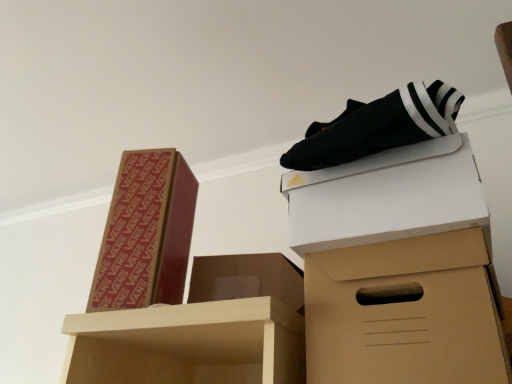
Question: Does brown cardboard box at upper left, arranged as the 3th box when viewed from the right, have a lesser height compared to brown cardboard box at lower right?

Choices:
 (A) no
 (B) yes

Answer: (A)

Question: Is the surface of brown cardboard box at upper left, the first box positioned from the left, in direct contact with brown cardboard box at lower right?

Choices:
 (A) yes
 (B) no

Answer: (B)

Question: From a real-world perspective, is brown cardboard box at upper left, arranged as the 3th box when viewed from the right, under brown cardboard box at lower right?

Choices:
 (A) yes
 (B) no

Answer: (B)

Question: Could you tell me if brown cardboard box at upper left, arranged as the 3th box when viewed from the right, is turned towards brown cardboard box at lower right?

Choices:
 (A) no
 (B) yes

Answer: (A)

Question: Would you say brown cardboard box at upper left, arranged as the 3th box when viewed from the right, is outside brown cardboard box at lower right?

Choices:
 (A) no
 (B) yes

Answer: (B)

Question: Considering the relative positions of brown cardboard box at upper left, the first box positioned from the left, and brown cardboard box at lower right in the image provided, is brown cardboard box at upper left, the first box positioned from the left, to the right of brown cardboard box at lower right from the viewer's perspective?

Choices:
 (A) no
 (B) yes

Answer: (A)

Question: From a real-world perspective, is brown cardboard box at lower right physically above brown cardboard box at center, the second box viewed from the right?

Choices:
 (A) no
 (B) yes

Answer: (A)

Question: Does brown cardboard box at lower right have a larger size compared to brown cardboard box at center, marked as the 2th box in a left-to-right arrangement?

Choices:
 (A) no
 (B) yes

Answer: (B)

Question: Is brown cardboard box at lower right beside brown cardboard box at center, marked as the 2th box in a left-to-right arrangement?

Choices:
 (A) no
 (B) yes

Answer: (A)

Question: Does brown cardboard box at lower right have a lesser height compared to brown cardboard box at center, marked as the 2th box in a left-to-right arrangement?

Choices:
 (A) yes
 (B) no

Answer: (B)

Question: Is brown cardboard box at lower right turned away from brown cardboard box at center, the second box viewed from the right?

Choices:
 (A) yes
 (B) no

Answer: (B)

Question: Does brown cardboard box at lower right come behind brown cardboard box at center, the second box viewed from the right?

Choices:
 (A) no
 (B) yes

Answer: (A)

Question: From the image's perspective, would you say brown cardboard box at lower right is shown under white cardboard box at upper right, the first box positioned from the right?

Choices:
 (A) no
 (B) yes

Answer: (B)